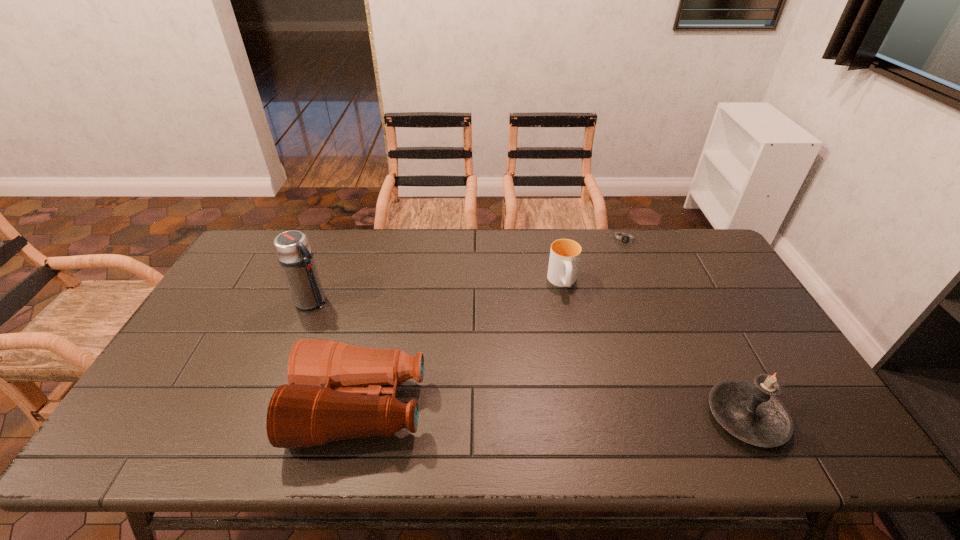
This screenshot has height=540, width=960. In order to click on free space located through the lenses of the second object from left to right in this screenshot , I will do `click(253, 408)`.

Where is `free location located 0.210m through the lenses of the second object from left to right`? free location located 0.210m through the lenses of the second object from left to right is located at coordinates (212, 408).

The height and width of the screenshot is (540, 960). Identify the location of vacant space located on the back of the second tallest object. (707, 341).

Image resolution: width=960 pixels, height=540 pixels. In order to click on free region located 0.100m with the handle on the side of the fourth tallest object in this screenshot , I will do `click(571, 322)`.

The height and width of the screenshot is (540, 960). In order to click on vacant position located with the handle on the side of the fourth tallest object in this screenshot , I will do `click(587, 392)`.

Where is `free space located 0.290m with the handle on the side of the fourth tallest object`? free space located 0.290m with the handle on the side of the fourth tallest object is located at coordinates click(x=584, y=375).

Where is `free space located 0.350m on the face of the farthest object`? free space located 0.350m on the face of the farthest object is located at coordinates (615, 317).

Locate an element on the screen. This screenshot has height=540, width=960. free space located 0.220m on the face of the farthest object is located at coordinates (619, 289).

Identify the location of vacant space positioned on the face of the farthest object. (618, 299).

Where is `free space located with a handle on the side of the thermos bottle`? The image size is (960, 540). free space located with a handle on the side of the thermos bottle is located at coordinates (405, 353).